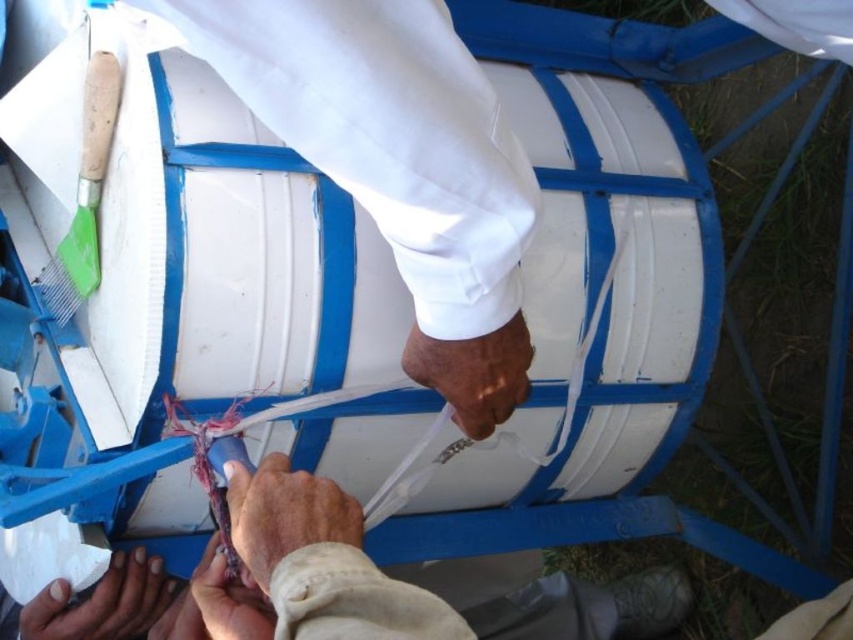
Does brown matte hand at center appear on the right side of dirty white hand at lower left?

Yes, brown matte hand at center is to the right of dirty white hand at lower left.

Does brown matte hand at center appear over dirty white hand at lower left?

Yes.

Find the location of a particular element. brown matte hand at center is located at coordinates (473, 372).

Which is in front, point (277, 481) or point (440, 376)?

Positioned in front is point (277, 481).

Who is taller, leather-like tan hand at center or brown matte hand at center?

Standing taller between the two is brown matte hand at center.

This screenshot has width=853, height=640. I want to click on leather-like tan hand at center, so click(283, 515).

From the picture: Can you confirm if dirty white hand at lower left is positioned to the left of smooth skin hand at lower center?

Indeed, dirty white hand at lower left is positioned on the left side of smooth skin hand at lower center.

Does dirty white hand at lower left appear on the right side of smooth skin hand at lower center?

No, dirty white hand at lower left is not to the right of smooth skin hand at lower center.

The height and width of the screenshot is (640, 853). Describe the element at coordinates (102, 602) in the screenshot. I see `dirty white hand at lower left` at that location.

In order to click on dirty white hand at lower left in this screenshot , I will do `click(102, 602)`.